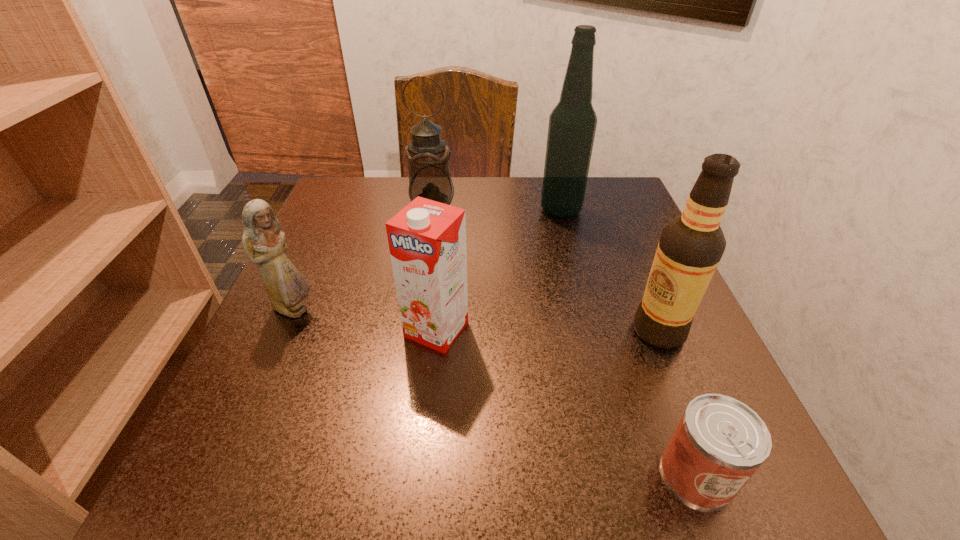
Where is `vacant region located on the label of the shorter alcohol`? vacant region located on the label of the shorter alcohol is located at coordinates (509, 331).

This screenshot has width=960, height=540. What are the coordinates of `vacant space located 0.200m on the label of the shorter alcohol` in the screenshot? It's located at (515, 331).

At what (x,y) coordinates should I click in order to perform the action: click on free space located 0.350m on the label of the shorter alcohol. Please return your answer as a coordinate pair (x, y). Looking at the image, I should click on (425, 331).

This screenshot has height=540, width=960. I want to click on vacant point located on the right of the oil lamp, so click(x=497, y=210).

Locate an element on the screen. vacant position located 0.070m on the front of the carton is located at coordinates (430, 391).

Where is `vacant space located 0.330m on the front-facing side of the figurine`? This screenshot has width=960, height=540. vacant space located 0.330m on the front-facing side of the figurine is located at coordinates (502, 310).

You are a GUI agent. You are given a task and a screenshot of the screen. Output one action in this format:
    pyautogui.click(x=<x>, y=<y>)
    Task: Click on the free space located 0.400m on the left of the can
    Image resolution: width=960 pixels, height=540 pixels.
    Given the screenshot: What is the action you would take?
    pyautogui.click(x=348, y=474)

Where is `alcohol at the far edge`? Image resolution: width=960 pixels, height=540 pixels. alcohol at the far edge is located at coordinates (572, 124).

Where is `oil lamp located in the far edge section of the desktop`? The image size is (960, 540). oil lamp located in the far edge section of the desktop is located at coordinates (427, 154).

The image size is (960, 540). Find the location of `object that is at the near edge`. object that is at the near edge is located at coordinates (719, 443).